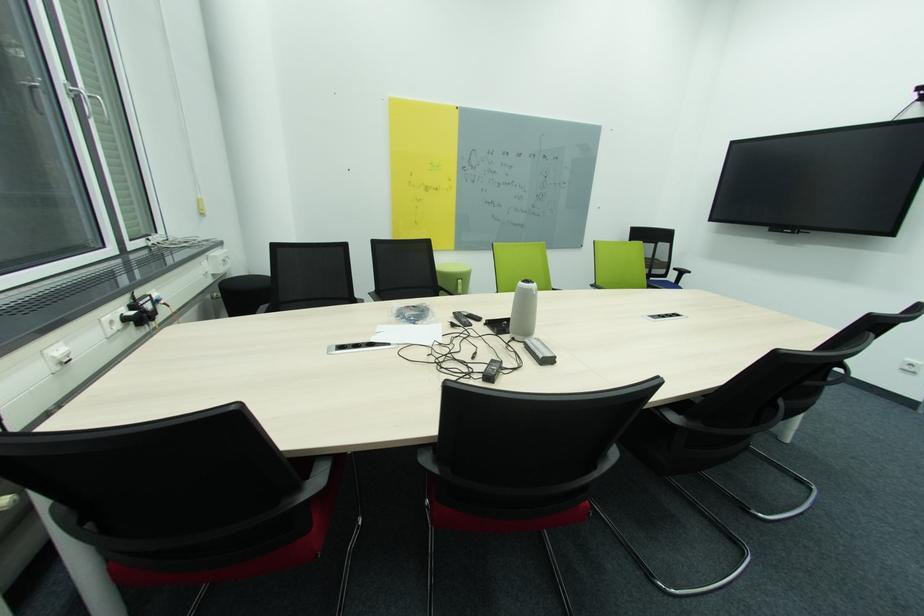
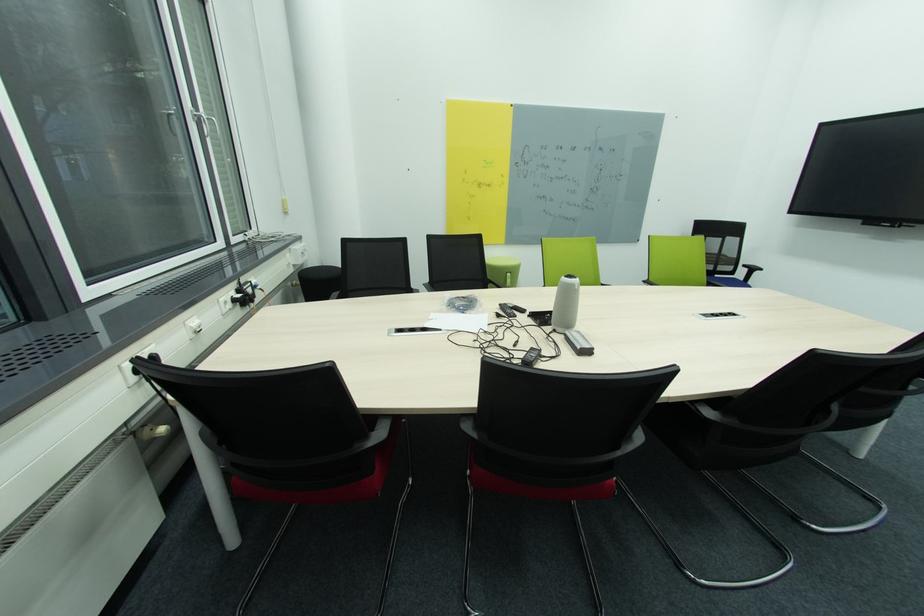
The point at (679, 270) is marked in the first image. Where is the corresponding point in the second image?

(749, 267)